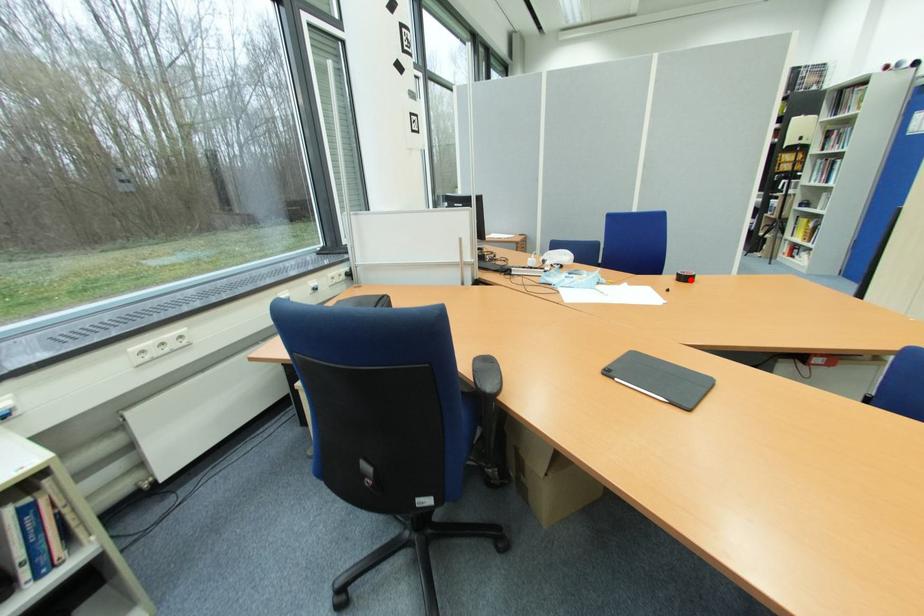
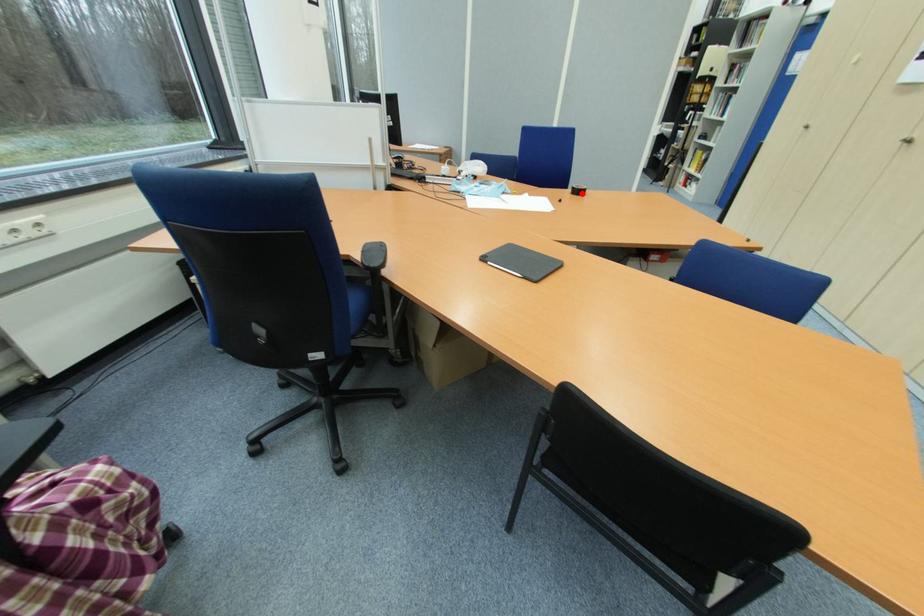
I am providing you with two images of the same scene from different viewpoints. A red point is marked on the first image and another point is marked on the second image. Does the point marked in image1 correspond to the same location as the one in image2?

Yes